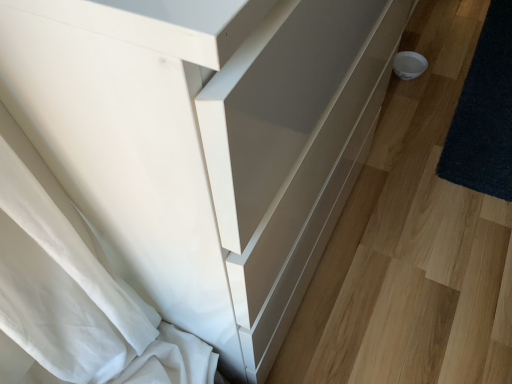
Question: Is white glossy drawer at lower right bigger or smaller than dark blue shaggy rug at lower right?

Choices:
 (A) small
 (B) big

Answer: (B)

Question: Considering the positions of white glossy drawer at lower right and dark blue shaggy rug at lower right in the image, is white glossy drawer at lower right taller or shorter than dark blue shaggy rug at lower right?

Choices:
 (A) short
 (B) tall

Answer: (A)

Question: Is white glossy drawer at lower right inside the boundaries of dark blue shaggy rug at lower right, or outside?

Choices:
 (A) outside
 (B) inside

Answer: (A)

Question: Based on their sizes in the image, would you say dark blue shaggy rug at lower right is bigger or smaller than white glossy drawer at lower right?

Choices:
 (A) small
 (B) big

Answer: (A)

Question: Is dark blue shaggy rug at lower right inside the boundaries of white glossy drawer at lower right, or outside?

Choices:
 (A) outside
 (B) inside

Answer: (B)

Question: From the image's perspective, is dark blue shaggy rug at lower right above or below white glossy drawer at lower right?

Choices:
 (A) above
 (B) below

Answer: (A)

Question: From a real-world perspective, relative to white glossy drawer at lower right, is dark blue shaggy rug at lower right vertically above or below?

Choices:
 (A) below
 (B) above

Answer: (A)